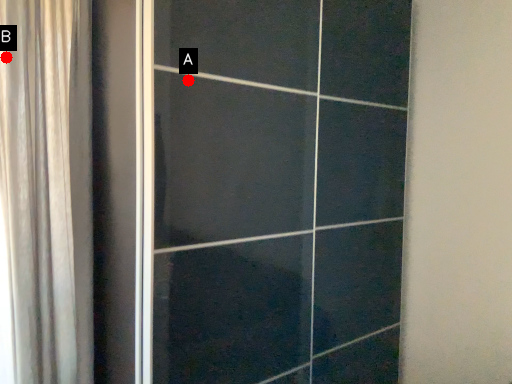
Question: Two points are circled on the image, labeled by A and B beside each circle. Which point appears closest to the camera in this image?

Choices:
 (A) A is closer
 (B) B is closer

Answer: (A)